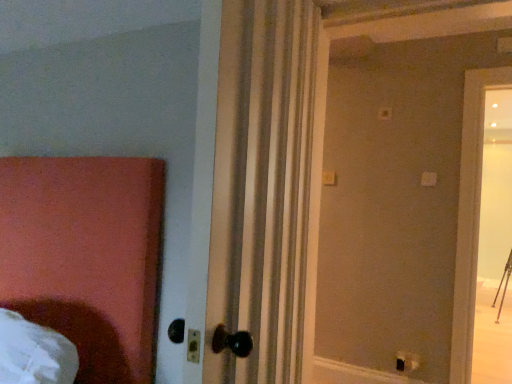
This screenshot has width=512, height=384. Describe the element at coordinates (261, 189) in the screenshot. I see `white striped curtain at center` at that location.

Find the location of `white striped curtain at center`. white striped curtain at center is located at coordinates (261, 189).

You are a GUI agent. You are given a task and a screenshot of the screen. Output one action in this format:
    pyautogui.click(x=<x>, y=<y>)
    Task: Click on the black plastic electric outlet at lower right
    
    Given the screenshot: What is the action you would take?
    pyautogui.click(x=407, y=361)

The width and height of the screenshot is (512, 384). Describe the element at coordinates (407, 361) in the screenshot. I see `black plastic electric outlet at lower right` at that location.

Identify the location of white striped curtain at center. This screenshot has height=384, width=512. (x=261, y=189).

In the image, is black plastic electric outlet at lower right on the left side or the right side of white striped curtain at center?

black plastic electric outlet at lower right is to the right of white striped curtain at center.

Does black plastic electric outlet at lower right lie behind white striped curtain at center?

Yes.

Does point (405, 355) lie behind point (256, 285)?

Yes, it is.

Consider the image. From the image's perspective, does black plastic electric outlet at lower right appear higher than white striped curtain at center?

No, from the image's perspective, black plastic electric outlet at lower right is not above white striped curtain at center.

Consider the image. From a real-world perspective, is black plastic electric outlet at lower right over white striped curtain at center?

No.

Considering the sizes of objects black plastic electric outlet at lower right and white striped curtain at center in the image provided, who is wider, black plastic electric outlet at lower right or white striped curtain at center?

With larger width is white striped curtain at center.

Between black plastic electric outlet at lower right and white striped curtain at center, which one has more height?

With more height is white striped curtain at center.

Considering the relative sizes of black plastic electric outlet at lower right and white striped curtain at center in the image provided, is black plastic electric outlet at lower right bigger than white striped curtain at center?

No, black plastic electric outlet at lower right is not bigger than white striped curtain at center.

Is black plastic electric outlet at lower right surrounding white striped curtain at center?

Definitely not — white striped curtain at center is not inside black plastic electric outlet at lower right.

Are black plastic electric outlet at lower right and white striped curtain at center far apart?

Indeed, black plastic electric outlet at lower right is not near white striped curtain at center.

Is black plastic electric outlet at lower right oriented towards white striped curtain at center?

No, black plastic electric outlet at lower right is not facing towards white striped curtain at center.

Could you measure the distance between black plastic electric outlet at lower right and white striped curtain at center?

black plastic electric outlet at lower right is 7.05 feet from white striped curtain at center.

Where is `electric outlet on the right of white striped curtain at center`? This screenshot has height=384, width=512. electric outlet on the right of white striped curtain at center is located at coordinates (407, 361).

Does white striped curtain at center appear on the right side of black plastic electric outlet at lower right?

Incorrect, white striped curtain at center is not on the right side of black plastic electric outlet at lower right.

Is the position of white striped curtain at center more distant than that of black plastic electric outlet at lower right?

No, white striped curtain at center is in front of black plastic electric outlet at lower right.

Which is behind, point (226, 184) or point (401, 368)?

Positioned behind is point (401, 368).

From the image's perspective, which is above, white striped curtain at center or black plastic electric outlet at lower right?

From the image's view, white striped curtain at center is above.

From a real-world perspective, is white striped curtain at center above or below black plastic electric outlet at lower right?

In terms of real-world spatial position, white striped curtain at center is above black plastic electric outlet at lower right.

Can you confirm if white striped curtain at center is wider than black plastic electric outlet at lower right?

Correct, the width of white striped curtain at center exceeds that of black plastic electric outlet at lower right.

Is white striped curtain at center taller or shorter than black plastic electric outlet at lower right?

In the image, white striped curtain at center appears to be taller than black plastic electric outlet at lower right.

Between white striped curtain at center and black plastic electric outlet at lower right, which one has larger size?

Bigger between the two is white striped curtain at center.

Is black plastic electric outlet at lower right completely or partially inside white striped curtain at center?

No.

Is white striped curtain at center not close to black plastic electric outlet at lower right?

Indeed, white striped curtain at center is not near black plastic electric outlet at lower right.

Could you tell me if white striped curtain at center is facing black plastic electric outlet at lower right?

No, white striped curtain at center is not facing towards black plastic electric outlet at lower right.

How different are the orientations of white striped curtain at center and black plastic electric outlet at lower right in degrees?

They differ by 85.9 degrees in their facing directions.

Identify the location of curtain above the black plastic electric outlet at lower right (from a real-world perspective). Image resolution: width=512 pixels, height=384 pixels. (261, 189).

Where is `curtain to the left of black plastic electric outlet at lower right`? The image size is (512, 384). curtain to the left of black plastic electric outlet at lower right is located at coordinates (261, 189).

In order to click on curtain in front of the black plastic electric outlet at lower right in this screenshot , I will do `click(261, 189)`.